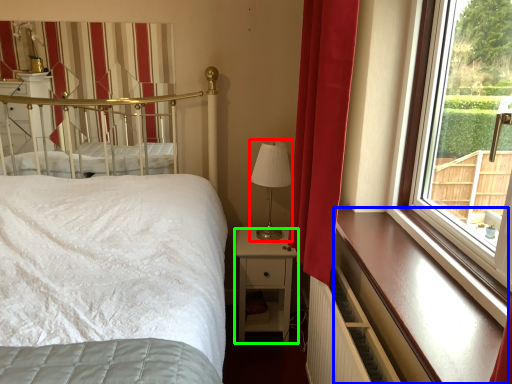
Question: Considering the real-world distances, which object is farthest from table lamp (highlighted by a red box)? ledge (highlighted by a blue box) or nightstand (highlighted by a green box)?

Choices:
 (A) ledge
 (B) nightstand

Answer: (A)